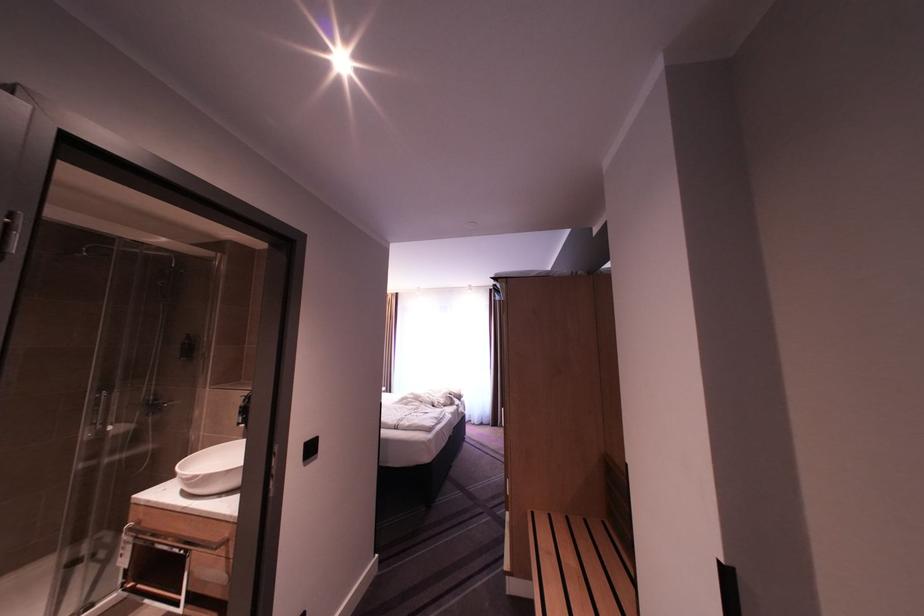
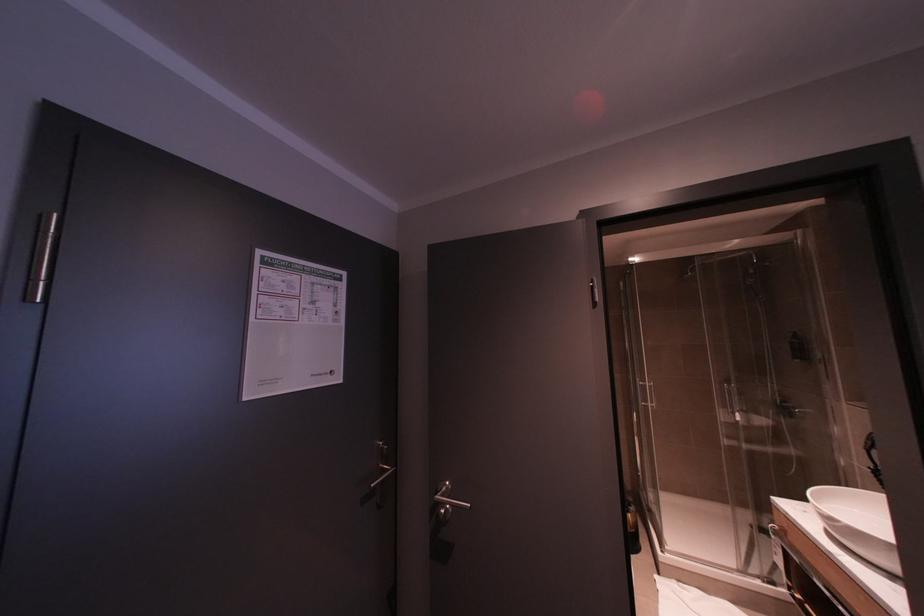
Question: The first image is from the beginning of the video and the second image is from the end. How did the camera likely rotate when shooting the video?

Choices:
 (A) Left
 (B) Right
 (C) Up
 (D) Down

Answer: (A)